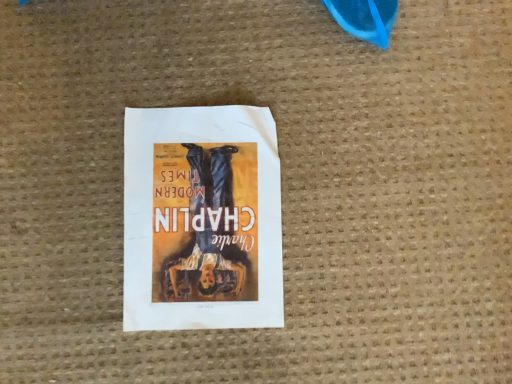
Find the location of a particular element. matte paper poster at center is located at coordinates (202, 219).

Describe the element at coordinates (202, 219) in the screenshot. The width and height of the screenshot is (512, 384). I see `matte paper poster at center` at that location.

Image resolution: width=512 pixels, height=384 pixels. In order to click on matte paper poster at center in this screenshot , I will do `click(202, 219)`.